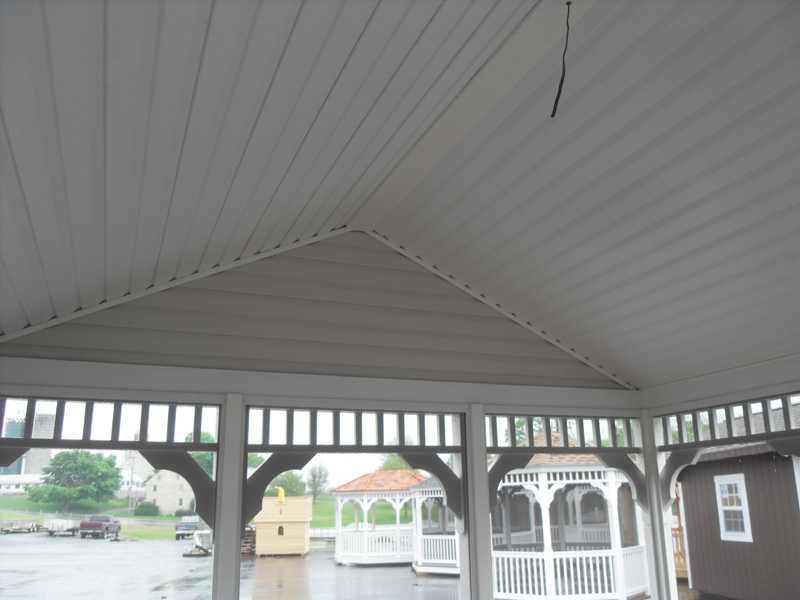
You are a GUI agent. You are given a task and a screenshot of the screen. Output one action in this format:
    pyautogui.click(x=<x>, y=<y>)
    Task: Click on the white panaled ceiling
    
    Given the screenshot: What is the action you would take?
    pyautogui.click(x=318, y=165)